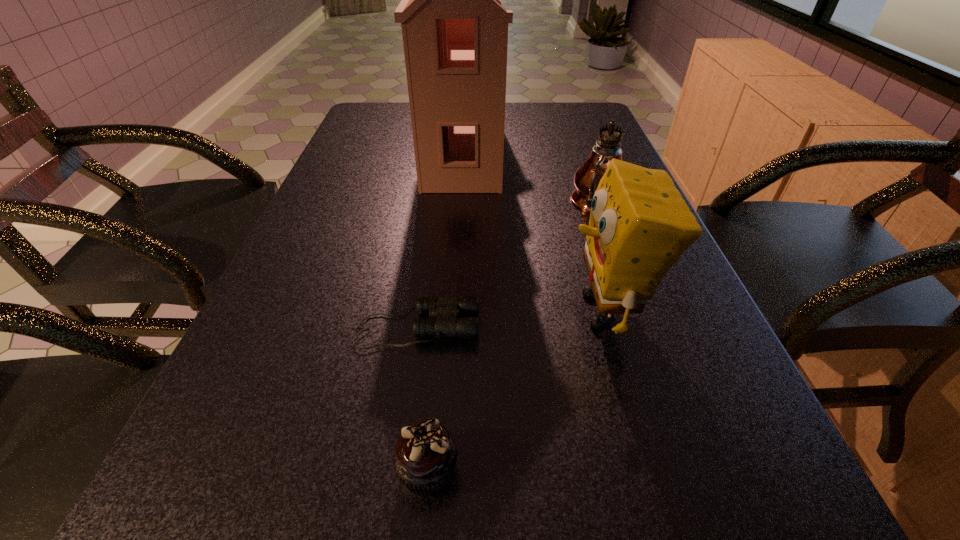
This screenshot has width=960, height=540. Identify the location of dollhouse. (455, 31).

Locate an element on the screen. The height and width of the screenshot is (540, 960). the fourth shortest object is located at coordinates (615, 114).

Find the location of `the third shortest object`. the third shortest object is located at coordinates (639, 226).

Image resolution: width=960 pixels, height=540 pixels. I want to click on the nearest object, so click(424, 459).

I want to click on cupcake, so (424, 459).

This screenshot has height=540, width=960. Find the location of `binoculars`. binoculars is located at coordinates (446, 310).

Image resolution: width=960 pixels, height=540 pixels. What are the coordinates of `free space located on the front-facing side of the dollhouse` in the screenshot? It's located at (588, 150).

I want to click on free location located 0.140m on the back of the fourth shortest object, so click(583, 160).

What are the coordinates of `vacant space located 0.150m on the face of the third shortest object` in the screenshot? It's located at (478, 310).

This screenshot has width=960, height=540. In order to click on vacant space located 0.050m on the face of the third shortest object in this screenshot , I will do [x=536, y=310].